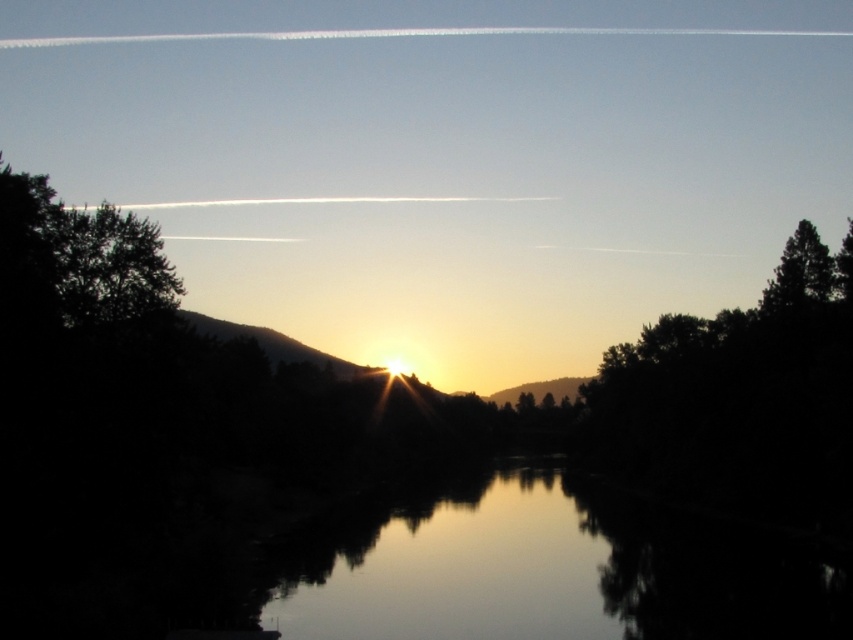
You are standing at the center of the scene and want to walk towards the dark green leafy tree at left and the dark green textured tree at right. Which direction should you face to walk towards both trees simultaneously?

You should face towards the left to walk towards the dark green leafy tree at left and the dark green textured tree at right simultaneously since the dark green leafy tree at left is to the left of dark green textured tree at right.

You are an artist planning to paint the sunset scene. You want to ensure the dark green leafy tree at left and the dark green textured tree at right are proportionally accurate. Which tree should you paint larger?

The dark green leafy tree at left should be painted larger since it has a larger size compared to the dark green textured tree at right according to the description.

You are a hiker standing at the center of the scene. You want to walk to both the dark green leafy tree at left and the dark green textured tree at right. Which tree will require you to walk a shorter distance?

The dark green leafy tree at left is 66.16 meters away from the dark green textured tree at right. Since you are standing at the center, the distance to each tree would be half of 66.16 meters, so both trees are equidistant from you. Therefore, neither requires a shorter walk than the other.